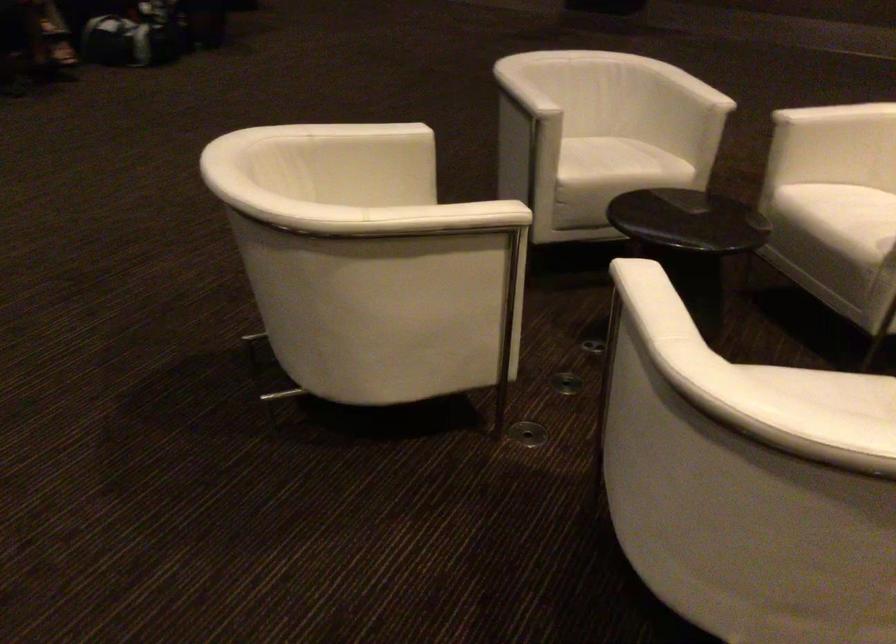
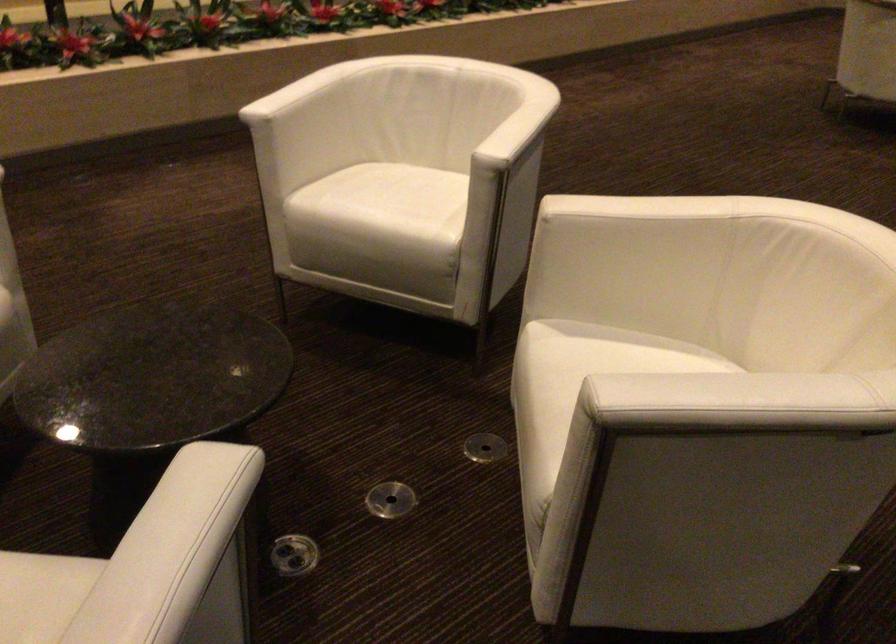
Find the pixel in the second image that matches point (652, 288) in the first image.

(515, 122)